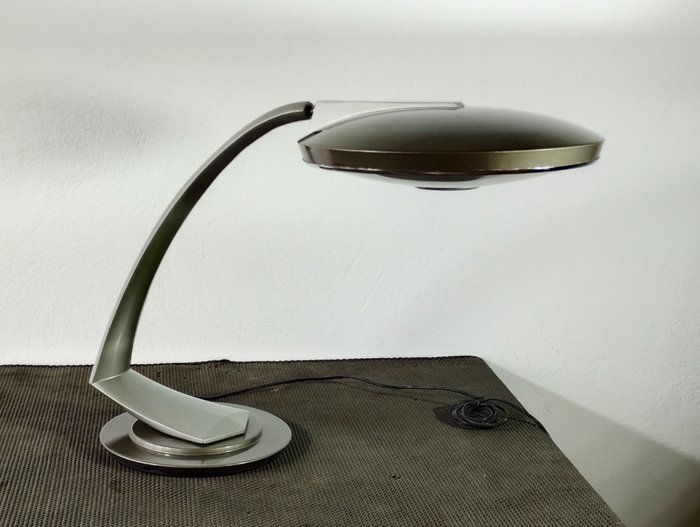
Where is `table top`? Image resolution: width=700 pixels, height=527 pixels. table top is located at coordinates (314, 489).